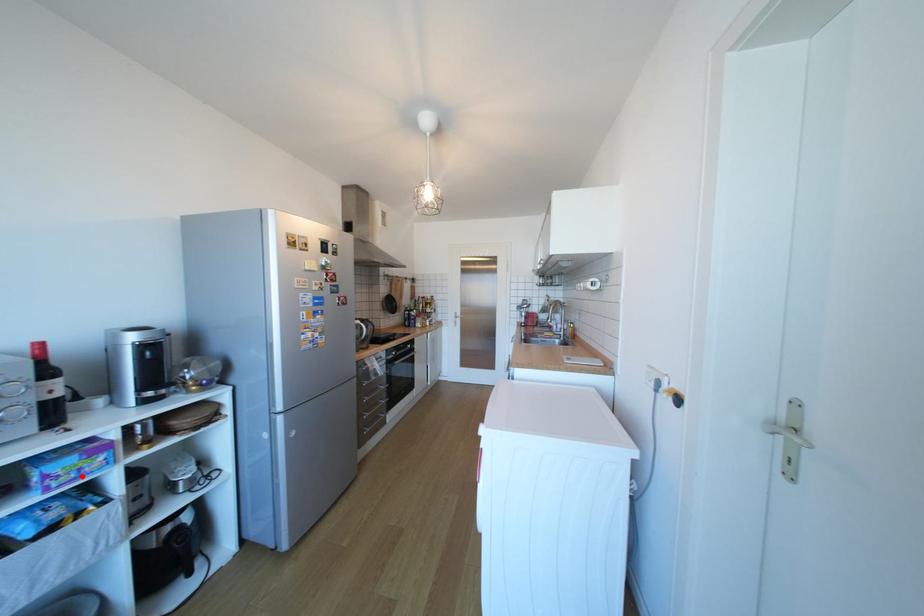
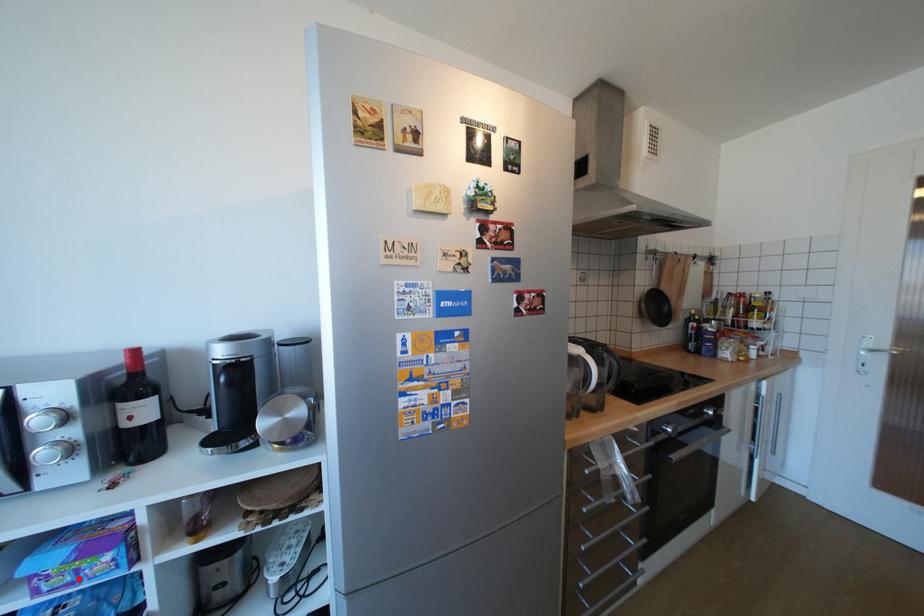
I am providing you with two images of the same scene from different viewpoints. A red point is marked on the first image and another point is marked on the second image. Do the highlighted points in image1 and image2 indicate the same real-world spot?

Yes